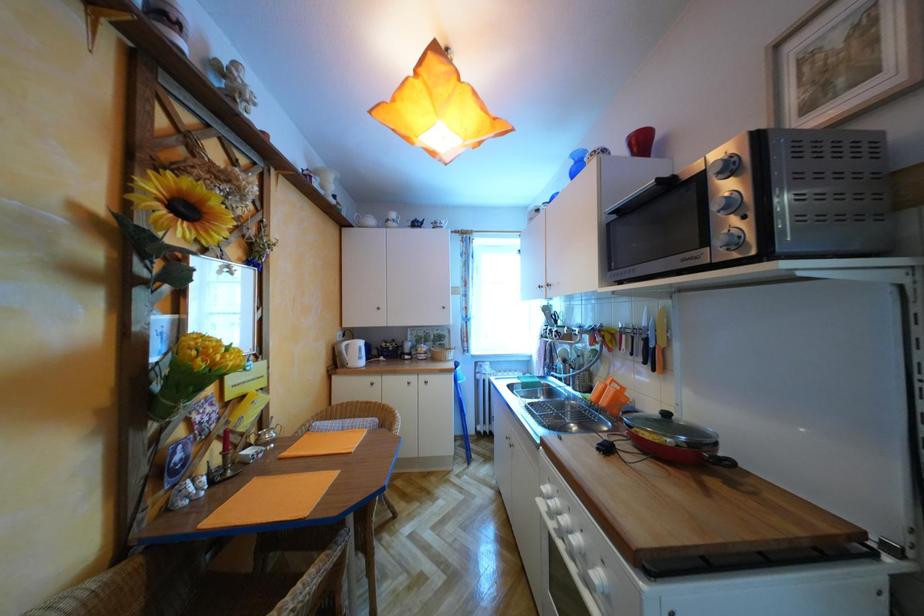
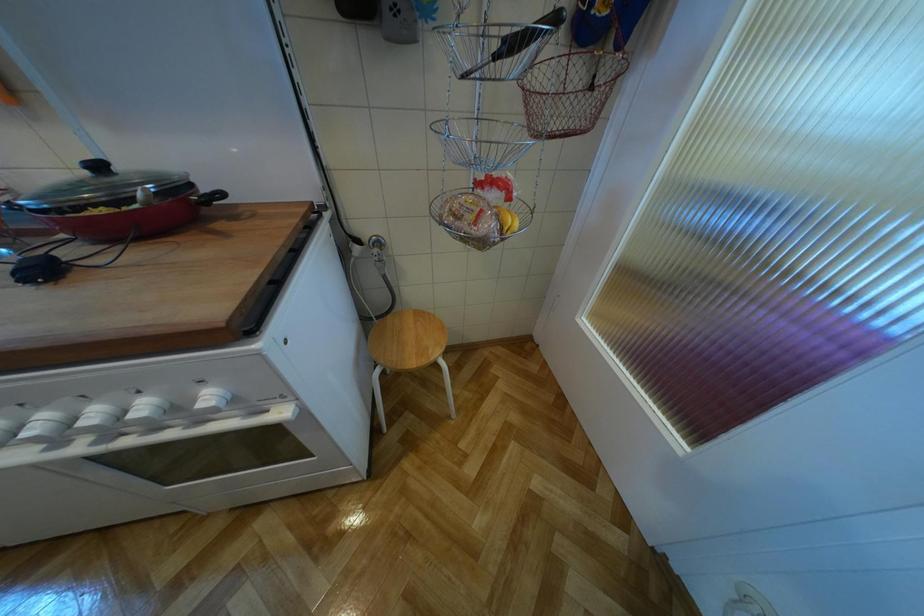
How did the camera likely rotate?

The rotation direction of the camera is right-down.